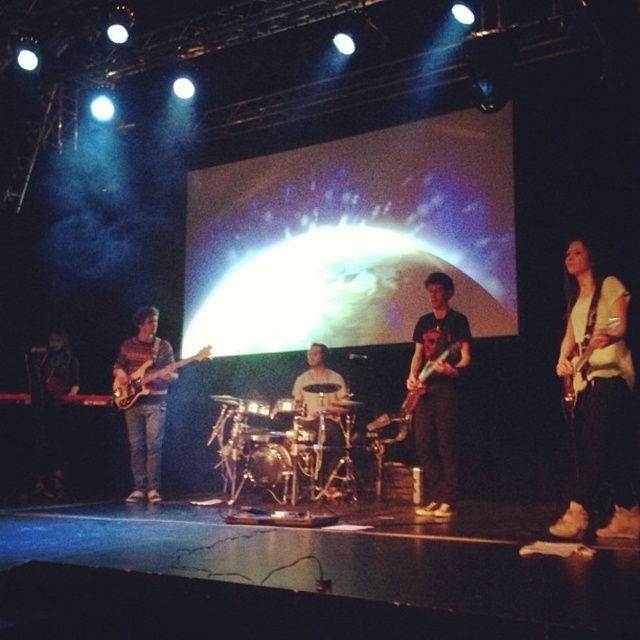
Who is more distant from viewer, [440,444] or [369,435]?

The point [369,435] is behind.

Is matte black guitar at center further to camera compared to matte black electric guitar at center?

That is False.

Is point (444, 449) farther from viewer compared to point (378, 435)?

No, it is in front of (378, 435).

Locate an element on the screen. matte black guitar at center is located at coordinates (436, 392).

Who is positioned more to the right, light yellow shirt at right or matte black electric guitar at center?

light yellow shirt at right is more to the right.

Which is above, light yellow shirt at right or matte black electric guitar at center?

Positioned higher is matte black electric guitar at center.

Between point (616, 529) and point (433, 372), which one is positioned in front?

Point (616, 529) is more forward.

Identify the location of light yellow shirt at right. The height and width of the screenshot is (640, 640). (596, 397).

Describe the element at coordinates (145, 401) in the screenshot. I see `knit sweater at left` at that location.

Can you confirm if knit sweater at left is taller than matte black electric guitar at center?

Indeed, knit sweater at left has a greater height compared to matte black electric guitar at center.

Is point (125, 380) positioned behind point (460, 346)?

That is True.

You are a GUI agent. You are given a task and a screenshot of the screen. Output one action in this format:
    pyautogui.click(x=<x>, y=<y>)
    Task: Click on the knit sweater at left
    This screenshot has width=640, height=640.
    Given the screenshot: What is the action you would take?
    (145, 401)